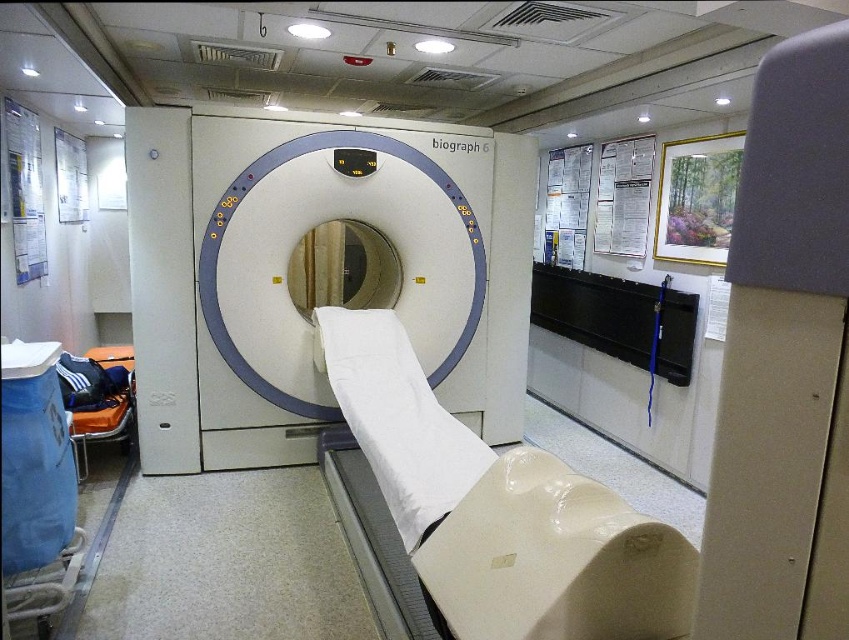
Between white plastic biograph 6 at center and white matte bed at center, which one is positioned higher?

Positioned higher is white plastic biograph 6 at center.

What do you see at coordinates (316, 272) in the screenshot? I see `white plastic biograph 6 at center` at bounding box center [316, 272].

Find the location of a particular element. Image resolution: width=849 pixels, height=640 pixels. white plastic biograph 6 at center is located at coordinates (316, 272).